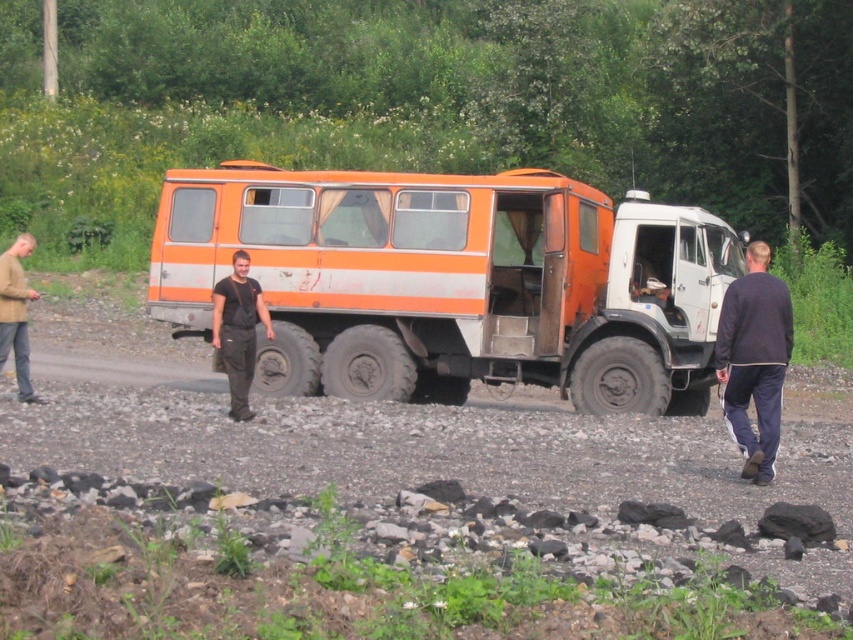
You are standing at the point marked as point (x=753, y=358). What is the nearest object to you in the scene?

The nearest object to point (x=753, y=358) is the dark blue sweatshirt at right, as the point is located on it.

You are a photographer trying to capture a photo of the dark blue sweatshirt at right and the dark gray fabric pants at center. Since you want to ensure both are in focus, which object should you focus on first to get the best depth of field?

The dark blue sweatshirt at right is much taller as dark gray fabric pants at center. Therefore, focusing on the dark blue sweatshirt at right first would ensure both are in focus because it is closer to the camera.